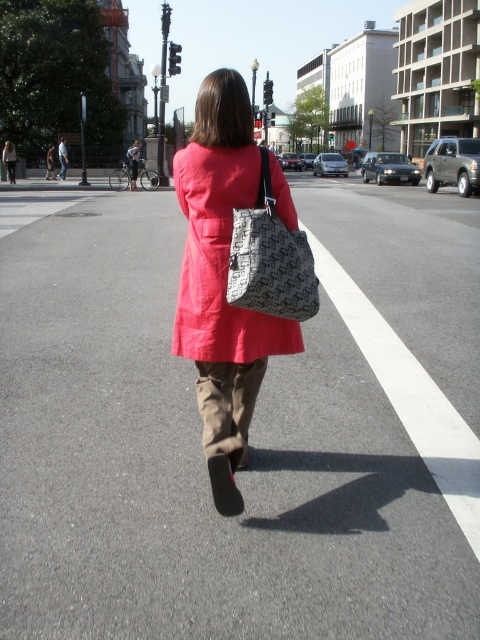
You are standing at the camera position looking at the scene. There is a point marked at coordinates [222,280]. What object is located at that point?

The point at coordinates [222,280] indicates the cotton coat at center.

You are standing at the camera position and want to throw a ball to a friend who is standing at point (272, 157). The ball travels in a straight line. How far will the ball travel before reaching your friend?

The ball will travel 9.63 feet to reach your friend at point (272, 157).